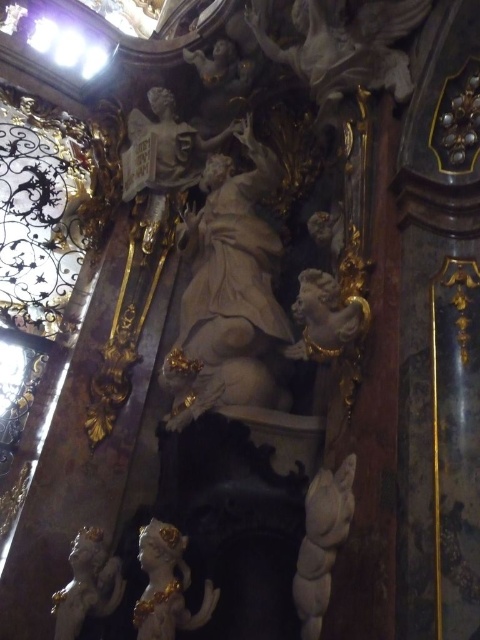
Question: From the image, what is the correct spatial relationship of golden polished statue at center in relation to white marble cherub at lower left?

Choices:
 (A) left
 (B) right

Answer: (B)

Question: Among these points, which one is farthest from the camera?

Choices:
 (A) (204, 620)
 (B) (69, 637)
 (C) (332, 497)
 (D) (226, 236)

Answer: (D)

Question: Is white marble cherub at center above white marble cherub at lower left?

Choices:
 (A) no
 (B) yes

Answer: (B)

Question: Which point is farther to the camera?

Choices:
 (A) white marble cherub at center
 (B) white marble cherub at lower left
 (C) white marble statue at center
 (D) golden polished statue at center

Answer: (C)

Question: Which object is farther from the camera taking this photo?

Choices:
 (A) white marble cherub at center
 (B) white marble cherub at lower left

Answer: (B)

Question: Can you confirm if white marble statue at center is bigger than white marble cherub at center?

Choices:
 (A) no
 (B) yes

Answer: (B)